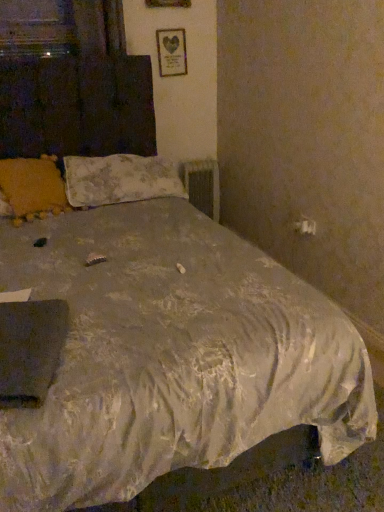
Question: Is yellow fabric pillow at upper left, acting as the second pillow starting from the right, outside of wooden frame with heart print at upper center?

Choices:
 (A) yes
 (B) no

Answer: (A)

Question: Is yellow fabric pillow at upper left, which ranks as the first pillow in left-to-right order, looking in the opposite direction of wooden frame with heart print at upper center?

Choices:
 (A) yes
 (B) no

Answer: (B)

Question: Is yellow fabric pillow at upper left, which ranks as the first pillow in left-to-right order, to the right of wooden frame with heart print at upper center from the viewer's perspective?

Choices:
 (A) no
 (B) yes

Answer: (A)

Question: From the image's perspective, is yellow fabric pillow at upper left, acting as the second pillow starting from the right, under wooden frame with heart print at upper center?

Choices:
 (A) yes
 (B) no

Answer: (A)

Question: Is yellow fabric pillow at upper left, which ranks as the first pillow in left-to-right order, positioned far away from wooden frame with heart print at upper center?

Choices:
 (A) no
 (B) yes

Answer: (B)

Question: In the image, is metallic silver radiator at center on the left side or the right side of wooden frame with heart print at upper center?

Choices:
 (A) left
 (B) right

Answer: (B)

Question: Is metallic silver radiator at center wider or thinner than wooden frame with heart print at upper center?

Choices:
 (A) thin
 (B) wide

Answer: (B)

Question: From the image's perspective, is metallic silver radiator at center positioned above or below wooden frame with heart print at upper center?

Choices:
 (A) below
 (B) above

Answer: (A)

Question: Is metallic silver radiator at center in front of or behind wooden frame with heart print at upper center in the image?

Choices:
 (A) front
 (B) behind

Answer: (B)

Question: From a real-world perspective, is wooden frame with heart print at upper center positioned above or below metallic silver radiator at center?

Choices:
 (A) below
 (B) above

Answer: (B)

Question: In the image, is wooden frame with heart print at upper center positioned in front of or behind metallic silver radiator at center?

Choices:
 (A) front
 (B) behind

Answer: (A)

Question: Which is correct: wooden frame with heart print at upper center is inside metallic silver radiator at center, or outside of it?

Choices:
 (A) inside
 (B) outside

Answer: (B)

Question: In terms of size, does wooden frame with heart print at upper center appear bigger or smaller than metallic silver radiator at center?

Choices:
 (A) small
 (B) big

Answer: (A)

Question: Is floral fabric pillow at upper left, which is the 2th pillow from left to right, taller or shorter than yellow fabric pillow at upper left, which ranks as the first pillow in left-to-right order?

Choices:
 (A) short
 (B) tall

Answer: (B)

Question: Is floral fabric pillow at upper left, arranged as the first pillow when viewed from the right, in front of or behind yellow fabric pillow at upper left, which ranks as the first pillow in left-to-right order, in the image?

Choices:
 (A) behind
 (B) front

Answer: (A)